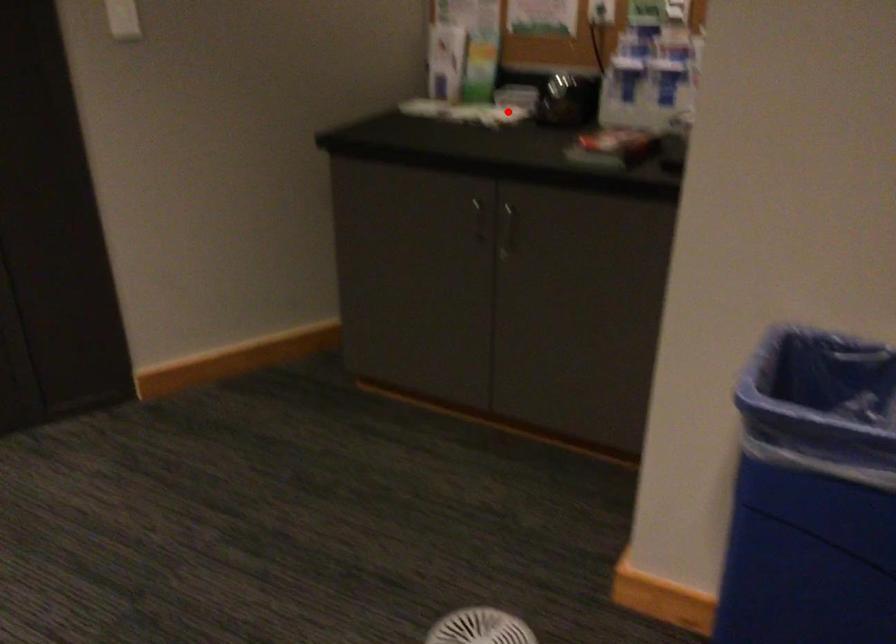
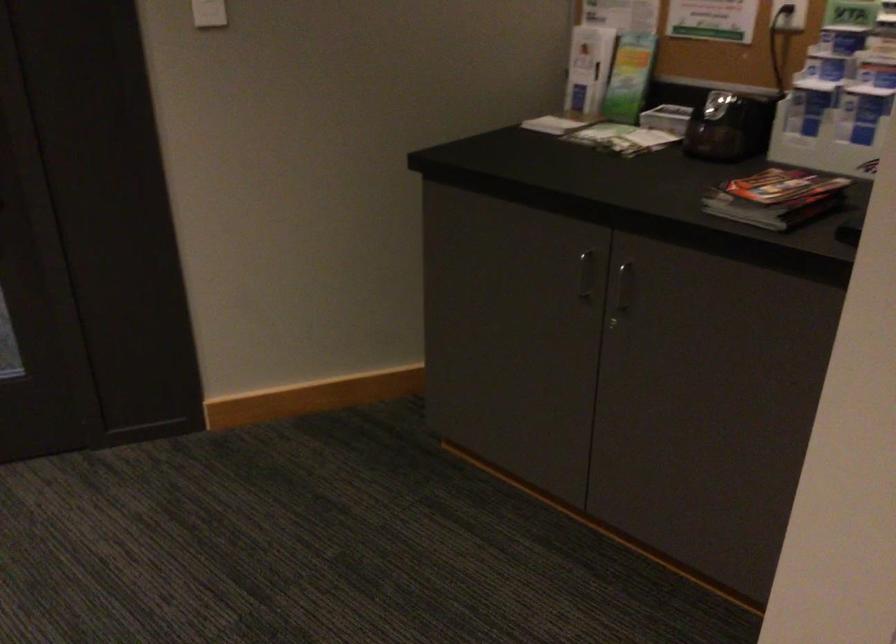
Question: I am providing you with two images of the same scene from different viewpoints. Given a red point in image1, look at the same physical point in image2. Is it:

Choices:
 (A) Closer to the viewpoint
 (B) Farther from the viewpoint

Answer: (A)